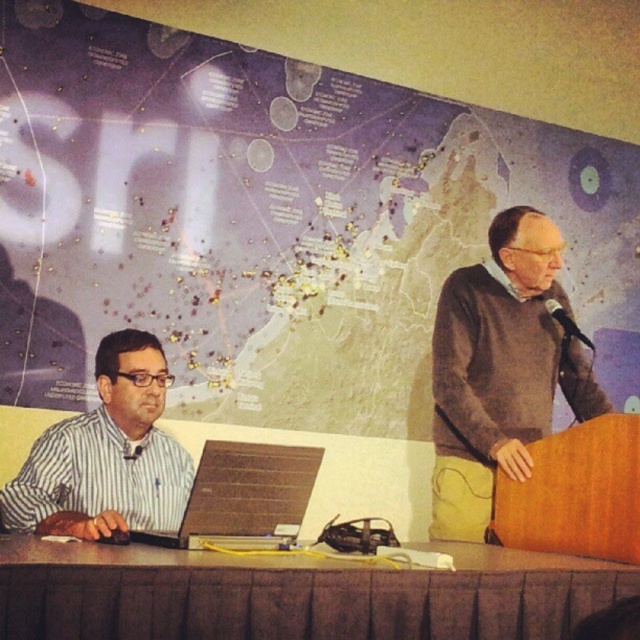
Between dark gray sweater at right and matte black laptop at left, which one is positioned lower?

Positioned lower is matte black laptop at left.

Who is more distant from viewer, (556, 241) or (260, 490)?

Point (556, 241)

Is point (464, 465) more distant than point (244, 516)?

Yes, it is.

Locate an element on the screen. The width and height of the screenshot is (640, 640). dark gray sweater at right is located at coordinates (500, 369).

Is point (102, 451) behind point (221, 460)?

That is True.

Can you confirm if striped fabric shirt at left is thinner than matte black laptop at left?

Correct, striped fabric shirt at left's width is less than matte black laptop at left's.

Who is more forward, (x=97, y=356) or (x=275, y=531)?

Point (x=275, y=531)

This screenshot has height=640, width=640. Find the location of `striped fabric shirt at left`. striped fabric shirt at left is located at coordinates (106, 456).

How distant is striped fabric shirt at left from black plastic microphone at upper right?

striped fabric shirt at left is 5.22 feet away from black plastic microphone at upper right.

Does striped fabric shirt at left appear on the left side of black plastic microphone at upper right?

Yes, striped fabric shirt at left is to the left of black plastic microphone at upper right.

Which is in front, point (81, 508) or point (566, 321)?

Point (81, 508) is in front.

Identify the location of striped fabric shirt at left. This screenshot has height=640, width=640. (106, 456).